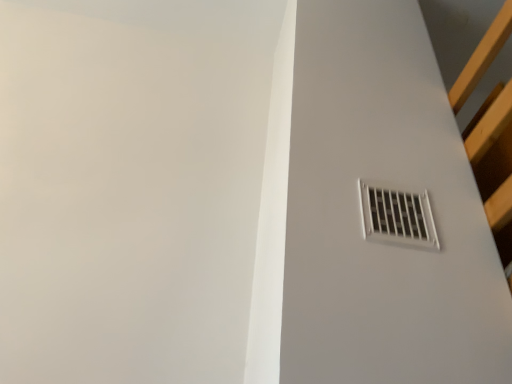
Question: Should I look upward or downward to see white plastic vent at upper right?

Choices:
 (A) up
 (B) down

Answer: (B)